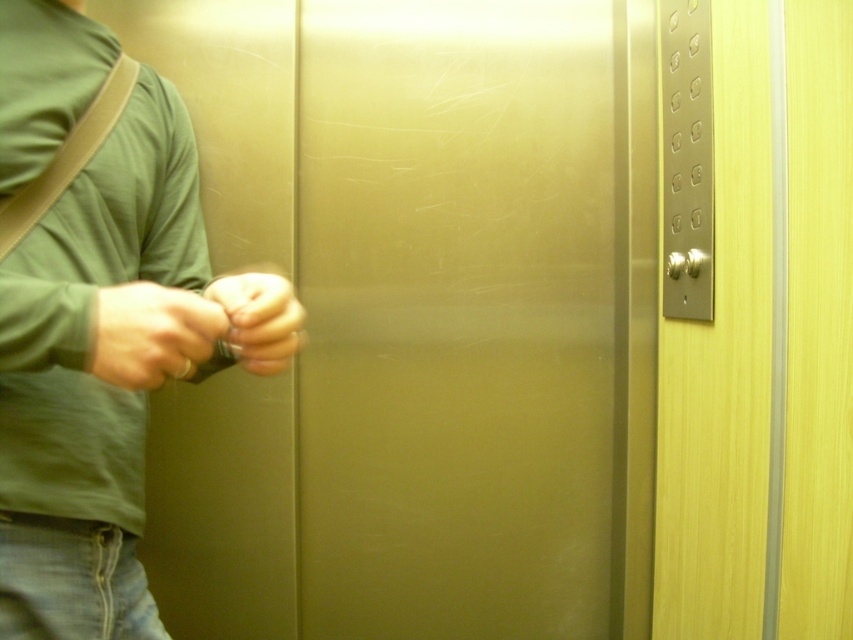
Question: Which object is positioned farthest from the satin gold elevator door at center?

Choices:
 (A) matte green shirt at left
 (B) matte black hand at center

Answer: (B)

Question: Can you confirm if matte green shirt at left is positioned below matte silver ring at center?

Choices:
 (A) yes
 (B) no

Answer: (A)

Question: Can you confirm if satin gold elevator door at center is positioned to the left of matte silver ring at center?

Choices:
 (A) no
 (B) yes

Answer: (A)

Question: Based on their relative distances, which object is farther from the satin gold elevator door at center?

Choices:
 (A) matte black hand at center
 (B) matte silver ring at center
 (C) matte green shirt at left

Answer: (A)

Question: Which object is closer to the camera taking this photo?

Choices:
 (A) matte green shirt at left
 (B) satin gold elevator door at center

Answer: (A)

Question: Is satin gold elevator door at center bigger than matte green shirt at left?

Choices:
 (A) no
 (B) yes

Answer: (B)